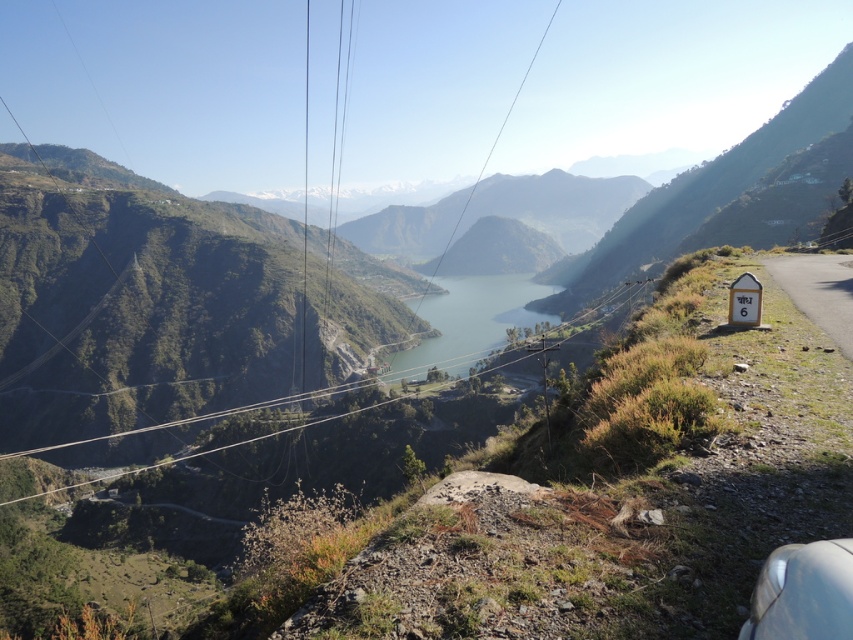
Who is taller, transparent wire at center or white glossy cable car at lower right?

transparent wire at center is taller.

The image size is (853, 640). What do you see at coordinates (167, 307) in the screenshot?
I see `transparent wire at center` at bounding box center [167, 307].

Does point (148, 321) come behind point (795, 544)?

That is True.

You are a GUI agent. You are given a task and a screenshot of the screen. Output one action in this format:
    pyautogui.click(x=<x>, y=<y>)
    Task: Click on the transparent wire at center
    
    Given the screenshot: What is the action you would take?
    pyautogui.click(x=167, y=307)

Does transparent wire at center appear under white plastic sign at right?

Actually, transparent wire at center is above white plastic sign at right.

Which is in front, point (189, 340) or point (834, 324)?

Positioned in front is point (834, 324).

In order to click on transparent wire at center in this screenshot , I will do `click(167, 307)`.

Is blue glassy lake at center positioned at the back of white glossy cable car at lower right?

Yes, blue glassy lake at center is behind white glossy cable car at lower right.

Does blue glassy lake at center have a larger size compared to white glossy cable car at lower right?

Yes, blue glassy lake at center is bigger than white glossy cable car at lower right.

Who is more forward, (410, 374) or (831, 580)?

Point (831, 580) is in front.

What are the coordinates of `blue glassy lake at center` in the screenshot? It's located at (467, 321).